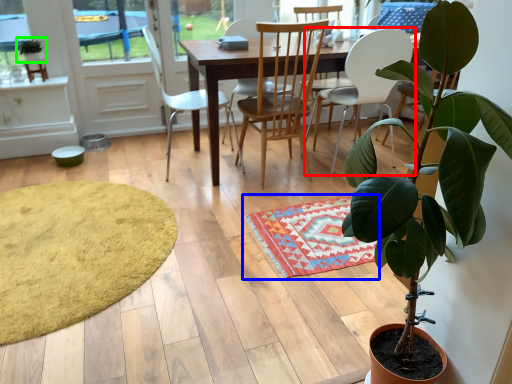
Question: Based on their relative distances, which object is nearer to chair (highlighted by a red box)? Choose from mat (highlighted by a blue box) and houseplant (highlighted by a green box).

Choices:
 (A) mat
 (B) houseplant

Answer: (A)